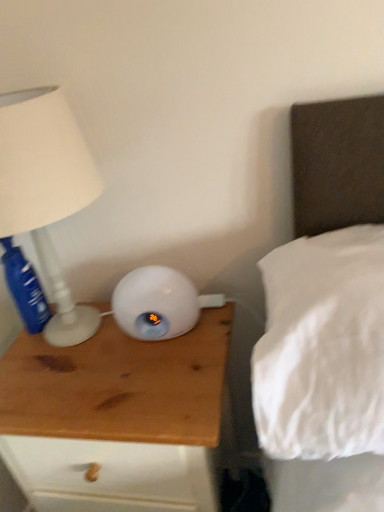
The height and width of the screenshot is (512, 384). I want to click on free space in front of blue plastic bottle at left, so click(x=46, y=361).